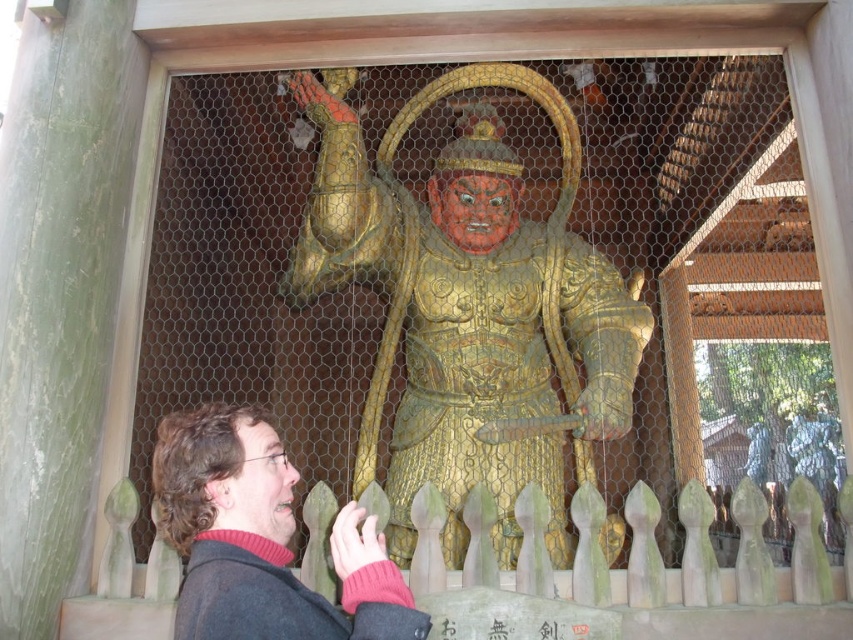
Is gold textured armor at center closer to the viewer compared to dark brown hair at lower left?

That is False.

Does point (560, 109) lie in front of point (178, 522)?

No, (560, 109) is behind (178, 522).

Identify the location of gold textured armor at center. The image size is (853, 640). (468, 305).